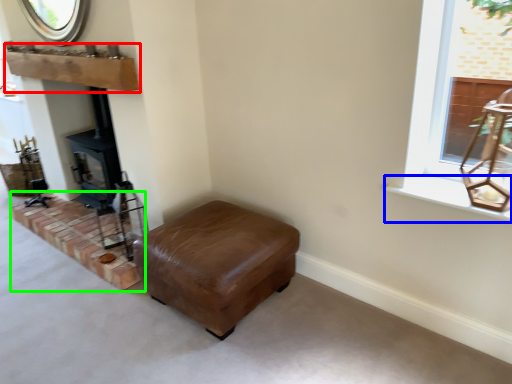
Question: Based on their relative distances, which object is nearer to mantle (highlighted by a red box)? Choose from window sill (highlighted by a blue box) and brickwork (highlighted by a green box).

Choices:
 (A) window sill
 (B) brickwork

Answer: (B)